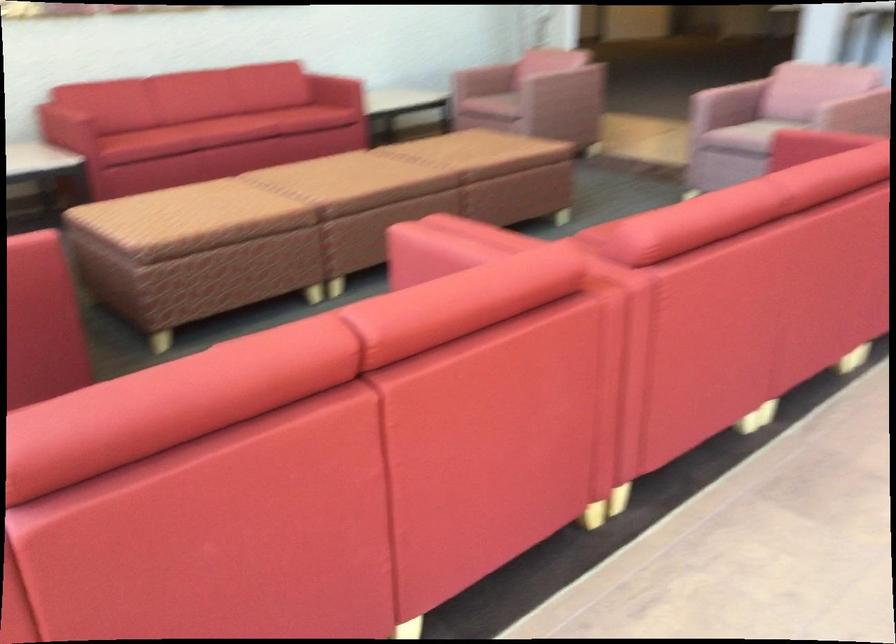
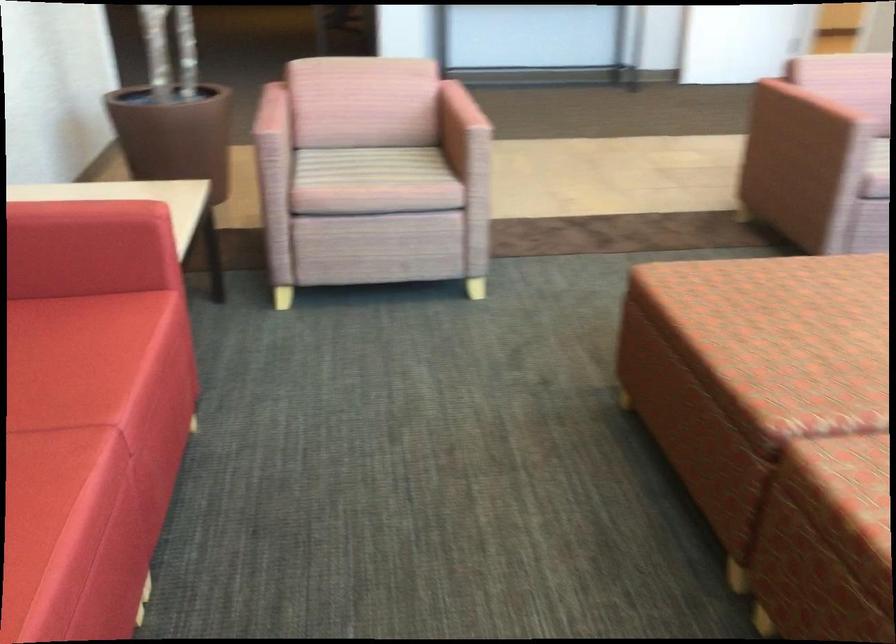
Where in the second image is the point corresponding to the point at 722,100 from the first image?

(810, 108)